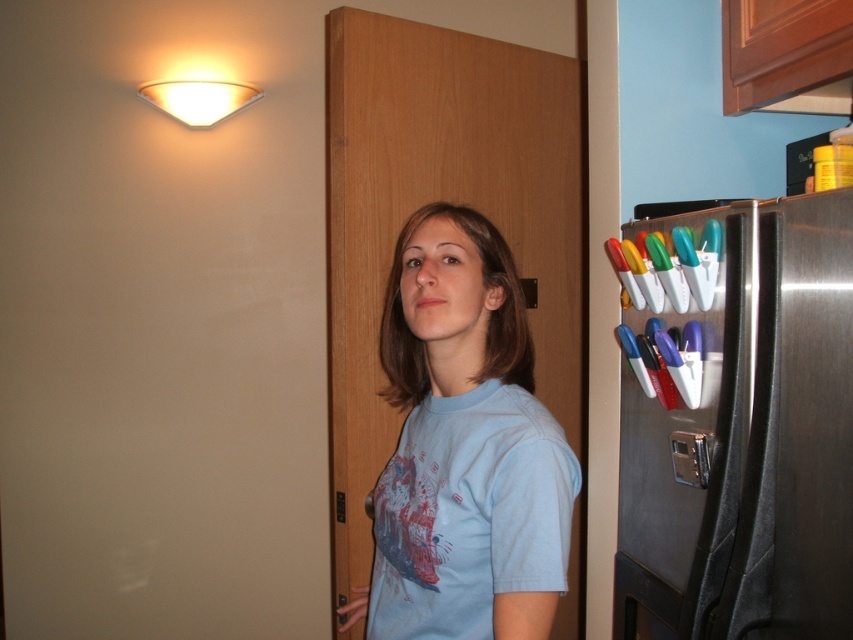
Does stainless steel refrigerator at right have a greater height compared to light blue cotton shirt at center?

Indeed, stainless steel refrigerator at right has a greater height compared to light blue cotton shirt at center.

Measure the distance between stainless steel refrigerator at right and light blue cotton shirt at center.

stainless steel refrigerator at right is 29.82 centimeters away from light blue cotton shirt at center.

Between point (773, 417) and point (418, 470), which one is positioned behind?

The point (418, 470) is behind.

I want to click on stainless steel refrigerator at right, so click(x=744, y=429).